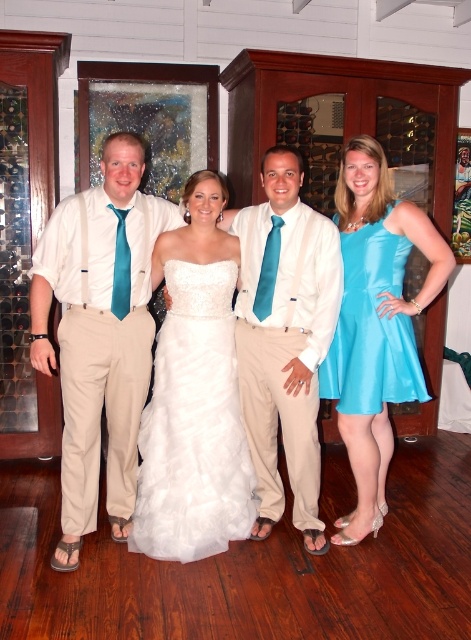
Which is above, teal satin tie at left or teal satin tie at center?

teal satin tie at left is higher up.

Does point (124, 285) lie behind point (276, 240)?

No, it is in front of (276, 240).

Where is `teal satin tie at left`? The width and height of the screenshot is (471, 640). teal satin tie at left is located at coordinates (121, 266).

Is matte white shirt at center to the right of teal satin tie at left from the viewer's perspective?

Correct, you'll find matte white shirt at center to the right of teal satin tie at left.

Between matte white shirt at center and teal satin tie at left, which one has less height?

Standing shorter between the two is teal satin tie at left.

Is point (282, 513) closer to viewer compared to point (115, 294)?

No, it is behind (115, 294).

What are the coordinates of `matte white shirt at center` in the screenshot? It's located at (284, 337).

Who is lower down, matte khaki pants at left or turquoise satin dress at center?

matte khaki pants at left is below.

Is matte khaki pants at left positioned behind turquoise satin dress at center?

No.

Does point (99, 371) lie behind point (330, 378)?

No, it is not.

This screenshot has width=471, height=640. What are the coordinates of `matte khaki pants at left` in the screenshot? It's located at 98,339.